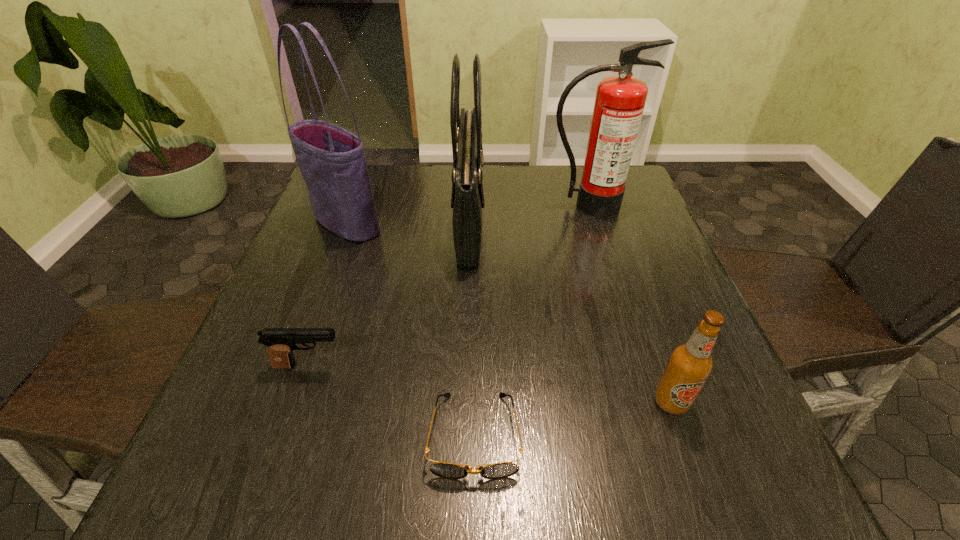
This screenshot has height=540, width=960. In order to click on the second closest object to the second shortest object in this screenshot , I will do `click(467, 201)`.

Point out which object is positioned as the nearest to the sunglasses. Please provide its 2D coordinates. Your answer should be formatted as a tuple, i.e. [(x, y)], where the tuple contains the x and y coordinates of a point satisfying the conditions above.

[(281, 342)]

This screenshot has height=540, width=960. I want to click on vacant area in the image that satisfies the following two spatial constraints: 1. on the front-facing side of the fire extinguisher; 2. with an open clasp on the front of the handbag, so click(593, 221).

Where is `free space that satisfies the following two spatial constraints: 1. on the front-facing side of the fire extinguisher; 2. at the barrel of the fifth tallest object`? The height and width of the screenshot is (540, 960). free space that satisfies the following two spatial constraints: 1. on the front-facing side of the fire extinguisher; 2. at the barrel of the fifth tallest object is located at coordinates (638, 366).

At what (x,y) coordinates should I click in order to perform the action: click on vacant space that satisfies the following two spatial constraints: 1. on the front-facing side of the fire extinguisher; 2. at the barrel of the third nearest object. Please return your answer as a coordinate pair (x, y). Looking at the image, I should click on (638, 366).